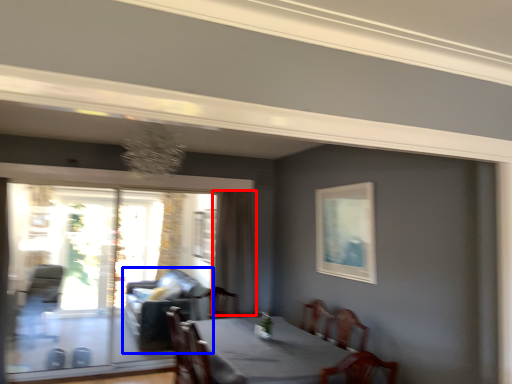
Question: Which object is closer to the camera taking this photo, curtain (highlighted by a red box) or couch (highlighted by a blue box)?

Choices:
 (A) curtain
 (B) couch

Answer: (A)